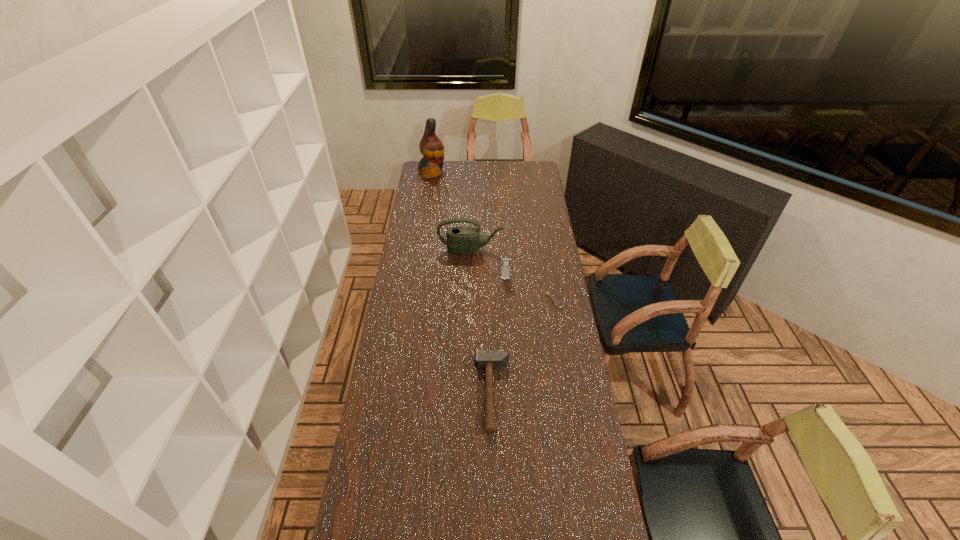
You are a GUI agent. You are given a task and a screenshot of the screen. Output one action in this format:
    pyautogui.click(x=<x>, y=<y>)
    Task: Click on the parrot
    This screenshot has width=960, height=540.
    Given the screenshot: What is the action you would take?
    pyautogui.click(x=431, y=147)

The height and width of the screenshot is (540, 960). In order to click on the tallest object in this screenshot , I will do pyautogui.click(x=431, y=147).

Identify the location of the fourth nearest object. 460,240.

Where is `watering can`? watering can is located at coordinates (460, 240).

The width and height of the screenshot is (960, 540). Identify the location of cellular telephone. (505, 268).

Where is `the third nearest object`? the third nearest object is located at coordinates (505, 268).

The height and width of the screenshot is (540, 960). I want to click on hammer, so click(x=484, y=359).

The width and height of the screenshot is (960, 540). I want to click on the nearest object, so click(x=484, y=359).

The image size is (960, 540). I want to click on the rightmost object, so click(x=558, y=304).

Locate an element on the screen. This screenshot has width=960, height=540. the second nearest object is located at coordinates (558, 304).